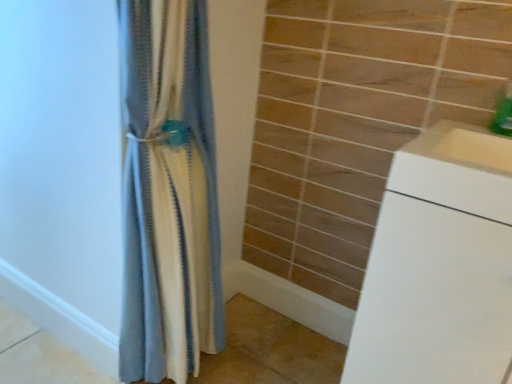
Question: From a real-world perspective, relative to green plastic soap dispenser at upper right, is blue textured fabric at center vertically above or below?

Choices:
 (A) below
 (B) above

Answer: (A)

Question: Is blue textured fabric at center situated inside green plastic soap dispenser at upper right or outside?

Choices:
 (A) outside
 (B) inside

Answer: (A)

Question: Considering the real-world distances, which object is closest to the white glossy cabinet at lower right?

Choices:
 (A) white matte drawer at right
 (B) blue textured fabric at center
 (C) green plastic soap dispenser at upper right

Answer: (A)

Question: Estimate the real-world distances between objects in this image. Which object is farther from the green plastic soap dispenser at upper right?

Choices:
 (A) white matte drawer at right
 (B) blue textured fabric at center
 (C) white glossy cabinet at lower right

Answer: (B)